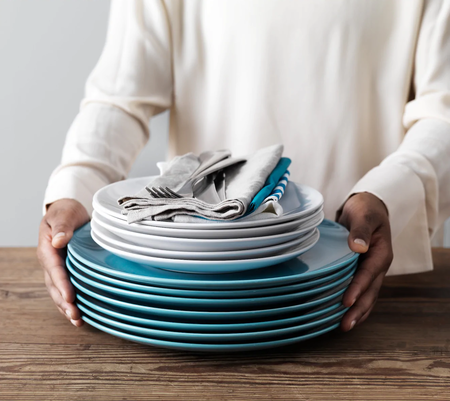
This screenshot has width=450, height=401. I want to click on blue plates, so click(x=168, y=345), click(x=177, y=334), click(x=188, y=326), click(x=197, y=314), click(x=204, y=303), click(x=211, y=295), click(x=215, y=284).